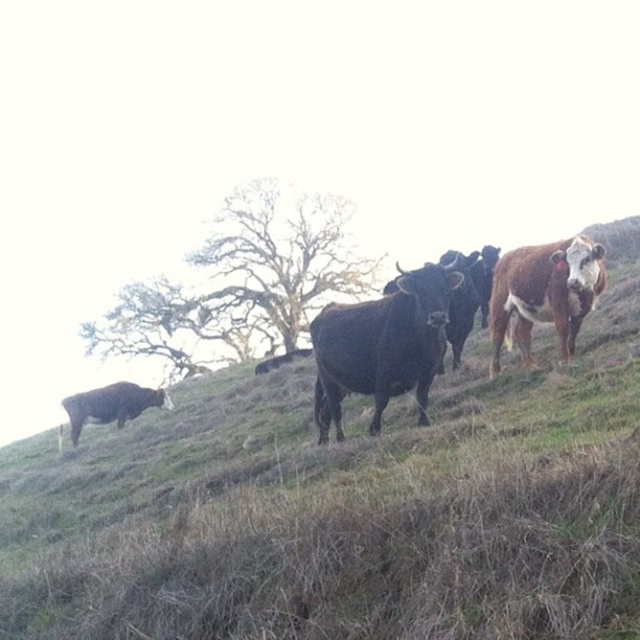
Which of these two, green grass at center or bare wood tree at upper center, stands taller?

bare wood tree at upper center

Does green grass at center have a larger size compared to bare wood tree at upper center?

No, green grass at center is not bigger than bare wood tree at upper center.

Is point (1, 618) farther from viewer compared to point (291, 300)?

That is False.

In order to click on green grass at center in this screenshot , I will do `click(348, 506)`.

Can you confirm if black glossy bull at center is positioned below shiny brown bull at lower left?

Incorrect, black glossy bull at center is not positioned below shiny brown bull at lower left.

Who is more distant from viewer, (340,436) or (122,401)?

Positioned behind is point (122,401).

Identify the location of black glossy bull at center. The height and width of the screenshot is (640, 640). (381, 346).

Can you confirm if bare wood tree at upper center is positioned above brown textured cow at right?

Actually, bare wood tree at upper center is below brown textured cow at right.

Who is positioned more to the right, bare wood tree at upper center or brown textured cow at right?

From the viewer's perspective, brown textured cow at right appears more on the right side.

Find the location of `bare wood tree at upper center`. bare wood tree at upper center is located at coordinates (243, 280).